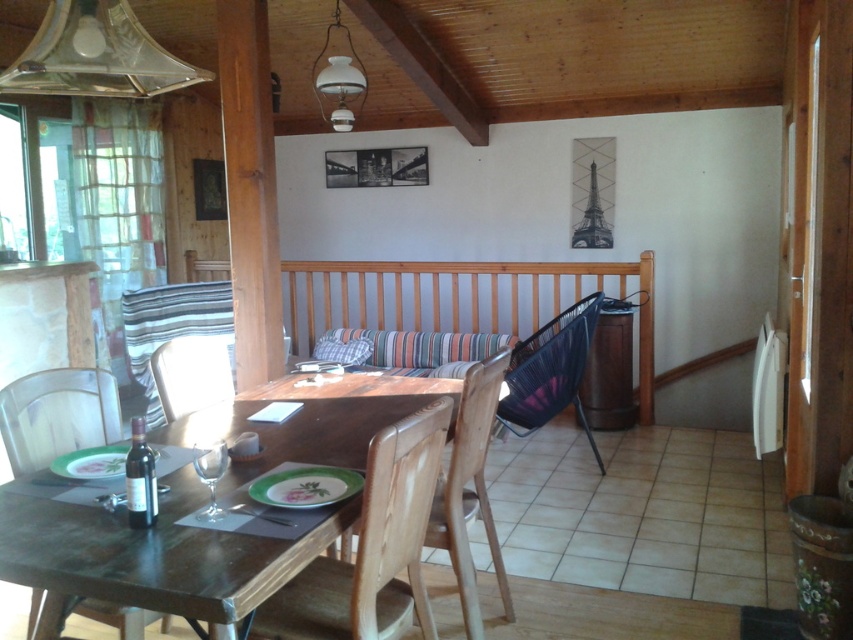
You are a server carrying a tray of dishes and need to navigate between the wooden table at center and the wooden chair at center. Is there enough space for you to pass through without bumping into either? Consider that the server requires at least 14 inches of clearance to move safely.

The distance between the wooden table at center and wooden chair at center is 12.85 inches. Since the server requires at least 14 inches of clearance, there isn not enough space to pass through safely without bumping into either object.